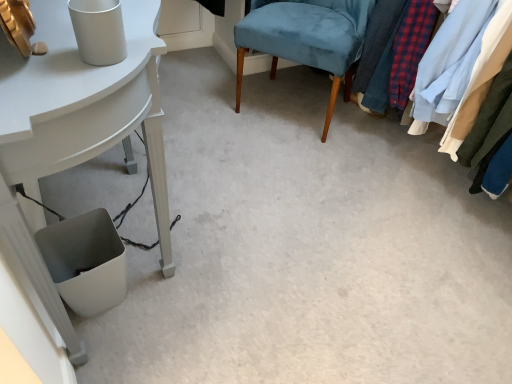
Question: Can you confirm if textured fabric clothes at right is taller than velvet blue chair at center?

Choices:
 (A) yes
 (B) no

Answer: (A)

Question: Considering the relative positions of textured fabric clothes at right and velvet blue chair at center in the image provided, is textured fabric clothes at right in front of velvet blue chair at center?

Choices:
 (A) no
 (B) yes

Answer: (B)

Question: Does textured fabric clothes at right have a lesser width compared to velvet blue chair at center?

Choices:
 (A) no
 (B) yes

Answer: (A)

Question: Considering the relative positions of textured fabric clothes at right and velvet blue chair at center in the image provided, is textured fabric clothes at right to the left of velvet blue chair at center from the viewer's perspective?

Choices:
 (A) yes
 (B) no

Answer: (B)

Question: Does textured fabric clothes at right have a smaller size compared to velvet blue chair at center?

Choices:
 (A) yes
 (B) no

Answer: (B)

Question: Is velvet blue chair at center taller or shorter than white glossy table at lower left?

Choices:
 (A) short
 (B) tall

Answer: (A)

Question: From the image's perspective, is velvet blue chair at center above or below white glossy table at lower left?

Choices:
 (A) below
 (B) above

Answer: (B)

Question: From a real-world perspective, is velvet blue chair at center above or below white glossy table at lower left?

Choices:
 (A) below
 (B) above

Answer: (A)

Question: In the image, is velvet blue chair at center positioned in front of or behind white glossy table at lower left?

Choices:
 (A) behind
 (B) front

Answer: (A)

Question: Is velvet blue chair at center in front of or behind textured fabric clothes at right in the image?

Choices:
 (A) front
 (B) behind

Answer: (B)

Question: Is velvet blue chair at center taller or shorter than textured fabric clothes at right?

Choices:
 (A) short
 (B) tall

Answer: (A)

Question: Considering the positions of point (250, 21) and point (475, 99), is point (250, 21) closer or farther from the camera than point (475, 99)?

Choices:
 (A) closer
 (B) farther

Answer: (B)

Question: From a real-world perspective, relative to textured fabric clothes at right, is velvet blue chair at center vertically above or below?

Choices:
 (A) below
 (B) above

Answer: (A)

Question: From a real-world perspective, is textured fabric clothes at right above or below white glossy table at lower left?

Choices:
 (A) above
 (B) below

Answer: (A)

Question: Would you say textured fabric clothes at right is to the left or to the right of white glossy table at lower left in the picture?

Choices:
 (A) left
 (B) right

Answer: (B)